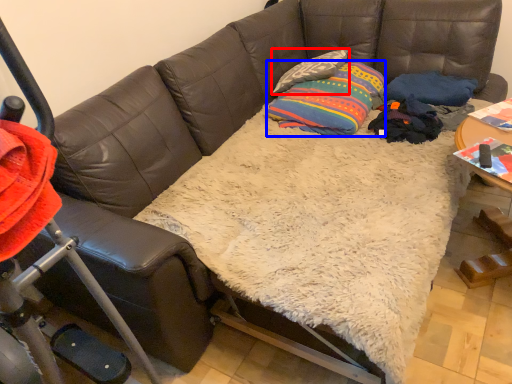
Question: Which object is closer to the camera taking this photo, pillow (highlighted by a red box) or throw pillow (highlighted by a blue box)?

Choices:
 (A) pillow
 (B) throw pillow

Answer: (B)